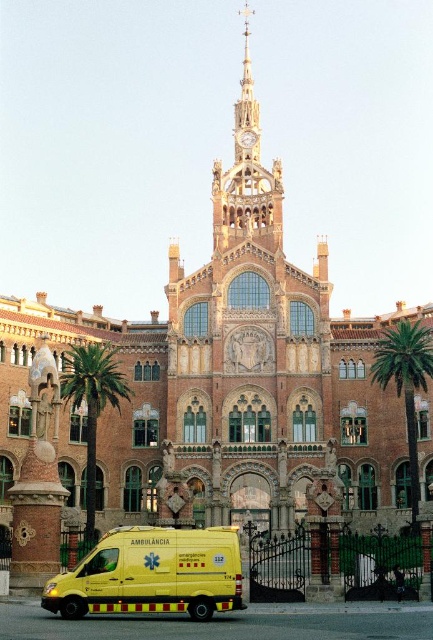
You are a pedestrian standing at the entrance of the grand ornate building and want to cross the street to reach the park on the other side. The yellow matte ambulance at lower center is blocking your path. Can you walk around it to reach the green leafy palm tree at right?

The yellow matte ambulance at lower center is smaller than the green leafy palm tree at right, so you can walk around the ambulance to reach the palm tree.

You are standing in front of the grand, ornate building described. You want to take a photo of the golden ornate clock tower at upper center. Considering your camera can focus on objects up to 100 meters away, will you be able to capture a clear image of the tower?

The golden ornate clock tower at upper center is 92.76 meters away from the viewer. Since your camera can focus up to 100 meters, you will be able to capture a clear image of the tower.